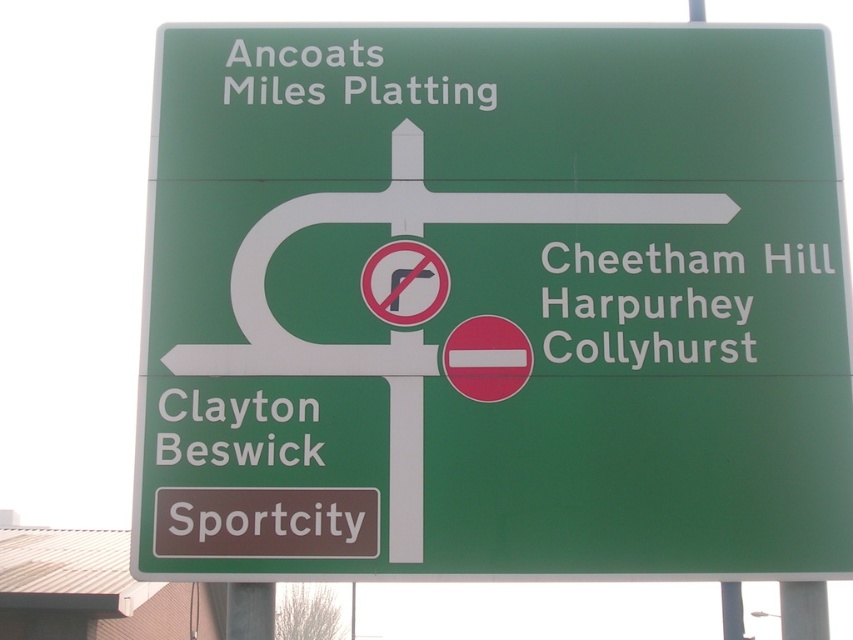
You are standing in front of the green matte sign at upper center and want to reach the white text on green sign at right. Which direction should you move relative to your current position?

Since the green matte sign at upper center is positioned on the left side of white text on green sign at right, you should move to your right to reach the white text on green sign at right.

You are a delivery driver who needs to ensure your vehicle can fit between two objects on the road. You see a green matte sign at upper center and a white text on green sign at upper center. Which object is wider?

The green matte sign at upper center is wider than the white text on green sign at upper center according to the description.